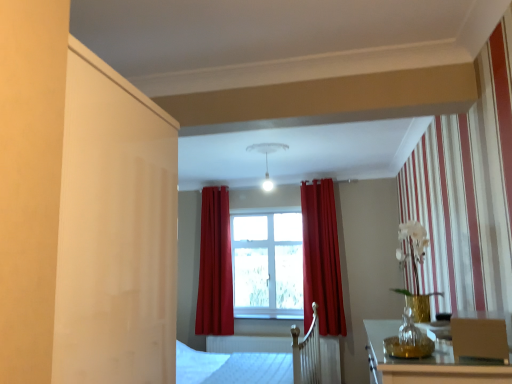
Question: Is matte brown armchair at lower right aimed at clear glass window at center?

Choices:
 (A) no
 (B) yes

Answer: (A)

Question: Is matte brown armchair at lower right positioned with its back to clear glass window at center?

Choices:
 (A) no
 (B) yes

Answer: (A)

Question: Does matte brown armchair at lower right contain clear glass window at center?

Choices:
 (A) no
 (B) yes

Answer: (A)

Question: From a real-world perspective, is matte brown armchair at lower right located higher than clear glass window at center?

Choices:
 (A) yes
 (B) no

Answer: (B)

Question: Does matte brown armchair at lower right come behind clear glass window at center?

Choices:
 (A) yes
 (B) no

Answer: (B)

Question: Do you think white wood bed frame at center is within white matte light fixture at upper center, or outside of it?

Choices:
 (A) inside
 (B) outside

Answer: (B)

Question: From their relative heights in the image, would you say white wood bed frame at center is taller or shorter than white matte light fixture at upper center?

Choices:
 (A) tall
 (B) short

Answer: (A)

Question: From the image's perspective, is white wood bed frame at center located above or below white matte light fixture at upper center?

Choices:
 (A) below
 (B) above

Answer: (A)

Question: Visually, is white wood bed frame at center positioned to the left or to the right of white matte light fixture at upper center?

Choices:
 (A) left
 (B) right

Answer: (B)

Question: Is transparent glass vase at lower right wider or thinner than matte red curtain at center, arranged as the second curtain when viewed from the right?

Choices:
 (A) wide
 (B) thin

Answer: (B)

Question: From a real-world perspective, relative to matte red curtain at center, arranged as the first curtain when viewed from the left, is transparent glass vase at lower right vertically above or below?

Choices:
 (A) below
 (B) above

Answer: (A)

Question: Considering their positions, is transparent glass vase at lower right located in front of or behind matte red curtain at center, arranged as the first curtain when viewed from the left?

Choices:
 (A) behind
 (B) front

Answer: (B)

Question: Considering the positions of transparent glass vase at lower right and matte red curtain at center, arranged as the second curtain when viewed from the right, in the image, is transparent glass vase at lower right bigger or smaller than matte red curtain at center, arranged as the second curtain when viewed from the right,?

Choices:
 (A) big
 (B) small

Answer: (B)

Question: Considering the positions of white matte light fixture at upper center and matte red curtain at center, the second curtain from the left, in the image, is white matte light fixture at upper center taller or shorter than matte red curtain at center, the second curtain from the left,?

Choices:
 (A) short
 (B) tall

Answer: (A)

Question: Does point (268, 187) appear closer or farther from the camera than point (326, 238)?

Choices:
 (A) closer
 (B) farther

Answer: (B)